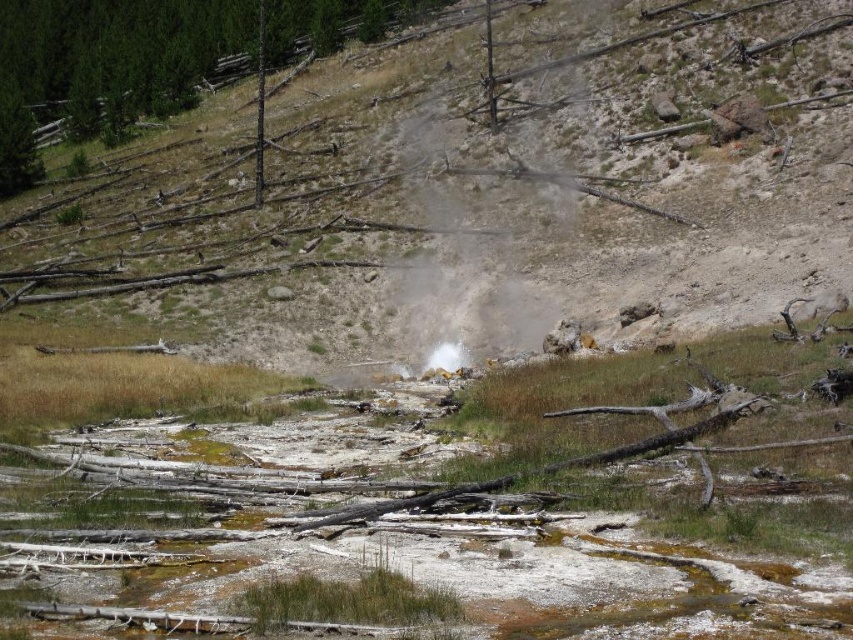
Does point (73, 196) come in front of point (74, 4)?

Yes, it is.

This screenshot has height=640, width=853. I want to click on yellowish rock at center, so click(x=473, y=189).

Which is behind, point (788, 35) or point (0, 118)?

The point (0, 118) is behind.

Where is `yellowish rock at center`? This screenshot has height=640, width=853. yellowish rock at center is located at coordinates (473, 189).